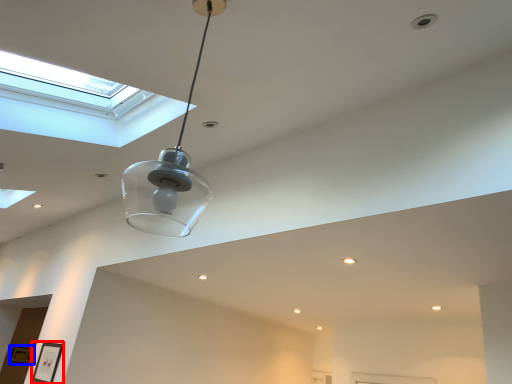
Question: Which of the following is the closest to the observer, picture frame (highlighted by a red box) or picture frame (highlighted by a blue box)?

Choices:
 (A) picture frame
 (B) picture frame

Answer: (A)